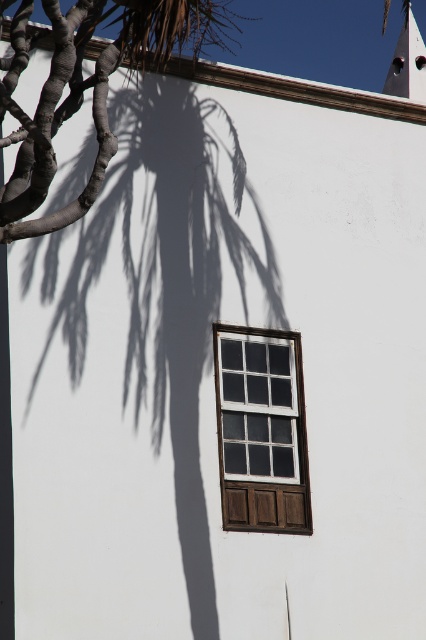
Question: Can you confirm if dark brown textured branches at left is wider than white wood window at center?

Choices:
 (A) no
 (B) yes

Answer: (B)

Question: Where is brown textured trunk at left located in relation to white wood window at center in the image?

Choices:
 (A) below
 (B) above

Answer: (B)

Question: Which point is farther to the camera?

Choices:
 (A) (54, 115)
 (B) (204, 433)
 (C) (302, 397)

Answer: (C)

Question: Which object appears closest to the camera in this image?

Choices:
 (A) dark brown textured branches at left
 (B) white wood window at center
 (C) brown textured trunk at left

Answer: (A)

Question: Which object is positioned farthest from the dark brown textured branches at left?

Choices:
 (A) brown textured trunk at left
 (B) white wood window at center

Answer: (B)

Question: Can you confirm if dark brown textured branches at left is wider than white wood window at center?

Choices:
 (A) yes
 (B) no

Answer: (A)